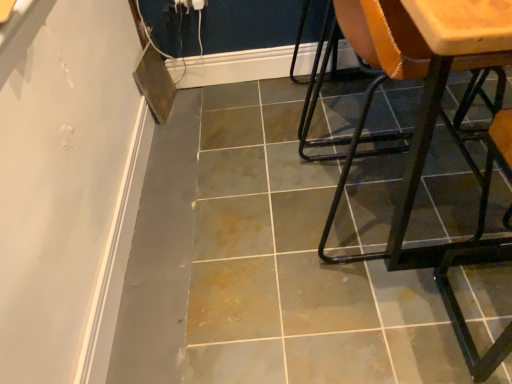
Find the location of `gray tile floor at center`. gray tile floor at center is located at coordinates (261, 263).

Where is `metallic orange chair at right, which ranks as the 2th chair in left-to-right order`? This screenshot has width=512, height=384. metallic orange chair at right, which ranks as the 2th chair in left-to-right order is located at coordinates (472, 251).

This screenshot has height=384, width=512. Find the location of `wooden seat at right, arranged as the 1th chair when viewed from the right`. wooden seat at right, arranged as the 1th chair when viewed from the right is located at coordinates (420, 178).

I want to click on gray tile floor at center, so click(x=261, y=263).

From a real-world perspective, is matte orange chair at right, positioned as the third chair in right-to-left order, located beneath metallic orange chair at right, which ranks as the 2th chair in left-to-right order?

Yes, from a real-world perspective, matte orange chair at right, positioned as the third chair in right-to-left order, is beneath metallic orange chair at right, which ranks as the 2th chair in left-to-right order.

Does matte orange chair at right, the first chair in the left-to-right sequence, touch metallic orange chair at right, which ranks as the 2th chair in right-to-left order?

No, matte orange chair at right, the first chair in the left-to-right sequence, is not next to metallic orange chair at right, which ranks as the 2th chair in right-to-left order.

Which of these two, matte orange chair at right, positioned as the third chair in right-to-left order, or metallic orange chair at right, which ranks as the 2th chair in right-to-left order, is smaller?

metallic orange chair at right, which ranks as the 2th chair in right-to-left order, is smaller.

Is matte orange chair at right, positioned as the third chair in right-to-left order, facing away from metallic orange chair at right, which ranks as the 2th chair in left-to-right order?

No, metallic orange chair at right, which ranks as the 2th chair in left-to-right order, is not at the back of matte orange chair at right, positioned as the third chair in right-to-left order.

Could you tell me if metallic orange chair at right, which ranks as the 2th chair in left-to-right order, is facing matte orange chair at right, the first chair in the left-to-right sequence?

Yes.

From the image's perspective, which object appears higher, metallic orange chair at right, which ranks as the 2th chair in right-to-left order, or matte orange chair at right, the first chair in the left-to-right sequence?

matte orange chair at right, the first chair in the left-to-right sequence, from the image's perspective.

Between metallic orange chair at right, which ranks as the 2th chair in left-to-right order, and matte orange chair at right, positioned as the third chair in right-to-left order, which one appears on the right side from the viewer's perspective?

metallic orange chair at right, which ranks as the 2th chair in left-to-right order, is more to the right.

Is matte orange chair at right, the first chair in the left-to-right sequence, located within metallic orange chair at right, which ranks as the 2th chair in right-to-left order?

Definitely not — matte orange chair at right, the first chair in the left-to-right sequence, is not inside metallic orange chair at right, which ranks as the 2th chair in right-to-left order.

Is point (127, 291) closer to camera compared to point (340, 27)?

No.

Considering the relative sizes of gray tile floor at center and matte orange chair at right, the first chair in the left-to-right sequence, in the image provided, is gray tile floor at center wider than matte orange chair at right, the first chair in the left-to-right sequence,?

Yes.

Looking at this image, can you confirm if gray tile floor at center is taller than matte orange chair at right, positioned as the third chair in right-to-left order?

In fact, gray tile floor at center may be shorter than matte orange chair at right, positioned as the third chair in right-to-left order.

Is gray tile floor at center oriented towards matte orange chair at right, positioned as the third chair in right-to-left order?

No, gray tile floor at center is not facing towards matte orange chair at right, positioned as the third chair in right-to-left order.

From a real-world perspective, does metallic orange chair at right, which ranks as the 2th chair in left-to-right order, stand above gray tile floor at center?

Correct, in the physical world, metallic orange chair at right, which ranks as the 2th chair in left-to-right order, is higher than gray tile floor at center.

Is the depth of metallic orange chair at right, which ranks as the 2th chair in right-to-left order, greater than that of gray tile floor at center?

No, it is in front of gray tile floor at center.

Considering the relative sizes of metallic orange chair at right, which ranks as the 2th chair in right-to-left order, and gray tile floor at center in the image provided, is metallic orange chair at right, which ranks as the 2th chair in right-to-left order, smaller than gray tile floor at center?

Correct, metallic orange chair at right, which ranks as the 2th chair in right-to-left order, occupies less space than gray tile floor at center.

Is there a large distance between metallic orange chair at right, which ranks as the 2th chair in left-to-right order, and gray tile floor at center?

No, there isn't a large distance between metallic orange chair at right, which ranks as the 2th chair in left-to-right order, and gray tile floor at center.

Which is in front, point (402, 16) or point (349, 211)?

The point (402, 16) is closer to the camera.

Could you tell me if wooden seat at right, acting as the 3th chair starting from the left, is turned towards gray tile floor at center?

No, wooden seat at right, acting as the 3th chair starting from the left, is not oriented towards gray tile floor at center.

Can you tell me how much wooden seat at right, acting as the 3th chair starting from the left, and gray tile floor at center differ in facing direction?

There is a 90.2-degree angle between the facing directions of wooden seat at right, acting as the 3th chair starting from the left, and gray tile floor at center.

Considering the relative positions of wooden seat at right, acting as the 3th chair starting from the left, and gray tile floor at center in the image provided, is wooden seat at right, acting as the 3th chair starting from the left, to the left or to the right of gray tile floor at center?

Based on their positions, wooden seat at right, acting as the 3th chair starting from the left, is located to the right of gray tile floor at center.

Considering the relative sizes of wooden seat at right, acting as the 3th chair starting from the left, and matte orange chair at right, the first chair in the left-to-right sequence, in the image provided, is wooden seat at right, acting as the 3th chair starting from the left, wider than matte orange chair at right, the first chair in the left-to-right sequence,?

Correct, the width of wooden seat at right, acting as the 3th chair starting from the left, exceeds that of matte orange chair at right, the first chair in the left-to-right sequence.

Which is more to the left, wooden seat at right, acting as the 3th chair starting from the left, or matte orange chair at right, the first chair in the left-to-right sequence?

matte orange chair at right, the first chair in the left-to-right sequence.

From the image's perspective, who appears lower, wooden seat at right, acting as the 3th chair starting from the left, or matte orange chair at right, the first chair in the left-to-right sequence?

wooden seat at right, acting as the 3th chair starting from the left, is shown below in the image.

Is wooden seat at right, acting as the 3th chair starting from the left, touching matte orange chair at right, the first chair in the left-to-right sequence?

No, wooden seat at right, acting as the 3th chair starting from the left, is not touching matte orange chair at right, the first chair in the left-to-right sequence.

From a real-world perspective, relative to metallic orange chair at right, which ranks as the 2th chair in right-to-left order, is wooden seat at right, acting as the 3th chair starting from the left, vertically above or below?

Clearly, from a real-world perspective, wooden seat at right, acting as the 3th chair starting from the left, is above metallic orange chair at right, which ranks as the 2th chair in right-to-left order.

From the image's perspective, would you say wooden seat at right, arranged as the 1th chair when viewed from the right, is shown under metallic orange chair at right, which ranks as the 2th chair in right-to-left order?

Actually, wooden seat at right, arranged as the 1th chair when viewed from the right, appears above metallic orange chair at right, which ranks as the 2th chair in right-to-left order, in the image.

Is wooden seat at right, arranged as the 1th chair when viewed from the right, taller than metallic orange chair at right, which ranks as the 2th chair in left-to-right order?

Yes.

Considering the relative positions of wooden seat at right, arranged as the 1th chair when viewed from the right, and metallic orange chair at right, which ranks as the 2th chair in left-to-right order, in the image provided, is wooden seat at right, arranged as the 1th chair when viewed from the right, behind metallic orange chair at right, which ranks as the 2th chair in left-to-right order,?

No, wooden seat at right, arranged as the 1th chair when viewed from the right, is in front of metallic orange chair at right, which ranks as the 2th chair in left-to-right order.

You are a GUI agent. You are given a task and a screenshot of the screen. Output one action in this format:
    pyautogui.click(x=<x>, y=<y>)
    Task: Click on the chair below the metallic orange chair at right, which ranks as the 2th chair in right-to-left order (from a real-world perspective)
    The width and height of the screenshot is (512, 384).
    Given the screenshot: What is the action you would take?
    pyautogui.click(x=365, y=56)

From the image's perspective, which chair is the 2nd one above the metallic orange chair at right, which ranks as the 2th chair in right-to-left order? Please provide its 2D coordinates.

[(365, 56)]

Looking at the image, which one is located further to metallic orange chair at right, which ranks as the 2th chair in right-to-left order, wooden seat at right, acting as the 3th chair starting from the left, or matte orange chair at right, positioned as the third chair in right-to-left order?

The object further to metallic orange chair at right, which ranks as the 2th chair in right-to-left order, is matte orange chair at right, positioned as the third chair in right-to-left order.

Based on their spatial positions, is gray tile floor at center or matte orange chair at right, the first chair in the left-to-right sequence, closer to metallic orange chair at right, which ranks as the 2th chair in right-to-left order?

gray tile floor at center is closer to metallic orange chair at right, which ranks as the 2th chair in right-to-left order.

Considering their positions, is matte orange chair at right, the first chair in the left-to-right sequence, positioned closer to gray tile floor at center than metallic orange chair at right, which ranks as the 2th chair in left-to-right order?

The object closer to gray tile floor at center is matte orange chair at right, the first chair in the left-to-right sequence.

Looking at the image, which one is located further to metallic orange chair at right, which ranks as the 2th chair in right-to-left order, matte orange chair at right, the first chair in the left-to-right sequence, or wooden seat at right, arranged as the 1th chair when viewed from the right?

matte orange chair at right, the first chair in the left-to-right sequence, is positioned further to the anchor metallic orange chair at right, which ranks as the 2th chair in right-to-left order.

Which object lies further to the anchor point metallic orange chair at right, which ranks as the 2th chair in right-to-left order, gray tile floor at center or wooden seat at right, acting as the 3th chair starting from the left?

The object further to metallic orange chair at right, which ranks as the 2th chair in right-to-left order, is gray tile floor at center.

Considering their positions, is wooden seat at right, acting as the 3th chair starting from the left, positioned closer to matte orange chair at right, positioned as the third chair in right-to-left order, than gray tile floor at center?

Based on the image, wooden seat at right, acting as the 3th chair starting from the left, appears to be nearer to matte orange chair at right, positioned as the third chair in right-to-left order.

Estimate the real-world distances between objects in this image. Which object is closer to metallic orange chair at right, which ranks as the 2th chair in right-to-left order, matte orange chair at right, positioned as the third chair in right-to-left order, or gray tile floor at center?

gray tile floor at center is closer to metallic orange chair at right, which ranks as the 2th chair in right-to-left order.

Consider the image. Based on their spatial positions, is matte orange chair at right, the first chair in the left-to-right sequence, or wooden seat at right, acting as the 3th chair starting from the left, closer to gray tile floor at center?

wooden seat at right, acting as the 3th chair starting from the left, lies closer to gray tile floor at center than the other object.

I want to click on concrete that lies between wooden seat at right, arranged as the 1th chair when viewed from the right, and metallic orange chair at right, which ranks as the 2th chair in left-to-right order, from top to bottom, so click(261, 263).

Where is `concrete between wooden seat at right, arranged as the 1th chair when viewed from the right, and matte orange chair at right, positioned as the third chair in right-to-left order, from front to back`? concrete between wooden seat at right, arranged as the 1th chair when viewed from the right, and matte orange chair at right, positioned as the third chair in right-to-left order, from front to back is located at coordinates (261, 263).

Identify the location of concrete between matte orange chair at right, positioned as the third chair in right-to-left order, and metallic orange chair at right, which ranks as the 2th chair in left-to-right order, from top to bottom. (261, 263).

Where is `chair between matte orange chair at right, the first chair in the left-to-right sequence, and metallic orange chair at right, which ranks as the 2th chair in right-to-left order, vertically`? Image resolution: width=512 pixels, height=384 pixels. chair between matte orange chair at right, the first chair in the left-to-right sequence, and metallic orange chair at right, which ranks as the 2th chair in right-to-left order, vertically is located at coordinates (420, 178).